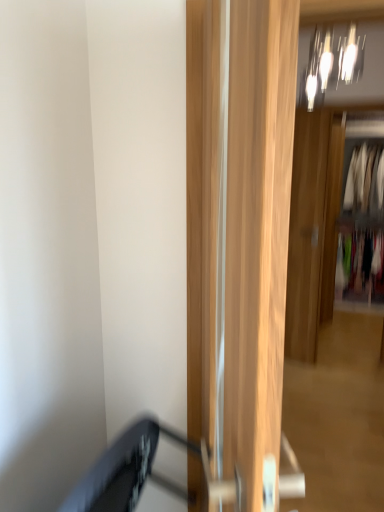
Question: Does multicolored fabric at right, the 1th clothing from the bottom, have a greater width compared to light wood door at center, arranged as the second door when viewed from the back?

Choices:
 (A) yes
 (B) no

Answer: (A)

Question: Is multicolored fabric at right, acting as the 3th clothing starting from the top, placed right next to light wood door at center, the first door in the left-to-right sequence?

Choices:
 (A) no
 (B) yes

Answer: (A)

Question: Is multicolored fabric at right, the 1th clothing from the bottom, located outside light wood door at center, arranged as the second door when viewed from the back?

Choices:
 (A) no
 (B) yes

Answer: (B)

Question: From a real-world perspective, is multicolored fabric at right, the 1th clothing from the bottom, over light wood door at center, the second door in the right-to-left sequence?

Choices:
 (A) yes
 (B) no

Answer: (B)

Question: Can you confirm if multicolored fabric at right, acting as the 3th clothing starting from the top, is smaller than light wood door at center, the first door in the left-to-right sequence?

Choices:
 (A) yes
 (B) no

Answer: (B)

Question: From a real-world perspective, is metallic glass light fixture at upper center above or below white fabric clothes at right, positioned as the 2th clothing in bottom-to-top order?

Choices:
 (A) above
 (B) below

Answer: (A)

Question: Looking at their shapes, would you say metallic glass light fixture at upper center is wider or thinner than white fabric clothes at right, positioned as the 2th clothing in bottom-to-top order?

Choices:
 (A) wide
 (B) thin

Answer: (B)

Question: Based on their positions, is metallic glass light fixture at upper center located to the left or right of white fabric clothes at right, positioned as the 2th clothing in bottom-to-top order?

Choices:
 (A) right
 (B) left

Answer: (B)

Question: Is point (332, 44) positioned closer to the camera than point (360, 196)?

Choices:
 (A) closer
 (B) farther

Answer: (A)

Question: Based on their sizes in the image, would you say white fabric clothes at right, which is the second clothing from top to bottom, is bigger or smaller than multicolored fabric at right, acting as the 3th clothing starting from the top?

Choices:
 (A) big
 (B) small

Answer: (A)

Question: From a real-world perspective, is white fabric clothes at right, positioned as the 2th clothing in bottom-to-top order, positioned above or below multicolored fabric at right, acting as the 3th clothing starting from the top?

Choices:
 (A) below
 (B) above

Answer: (B)

Question: Considering the positions of point (369, 257) and point (337, 267), is point (369, 257) closer or farther from the camera than point (337, 267)?

Choices:
 (A) closer
 (B) farther

Answer: (B)

Question: Based on their positions, is white fabric clothes at right, positioned as the 2th clothing in bottom-to-top order, located to the left or right of multicolored fabric at right, acting as the 3th clothing starting from the top?

Choices:
 (A) left
 (B) right

Answer: (A)

Question: Considering the positions of wooden door at center, the first door viewed from the right, and multicolored fabric at right, acting as the 3th clothing starting from the top, in the image, is wooden door at center, the first door viewed from the right, bigger or smaller than multicolored fabric at right, acting as the 3th clothing starting from the top,?

Choices:
 (A) small
 (B) big

Answer: (A)

Question: From the image's perspective, relative to multicolored fabric at right, the 1th clothing from the bottom, is wooden door at center, the first door viewed from the right, above or below?

Choices:
 (A) below
 (B) above

Answer: (B)